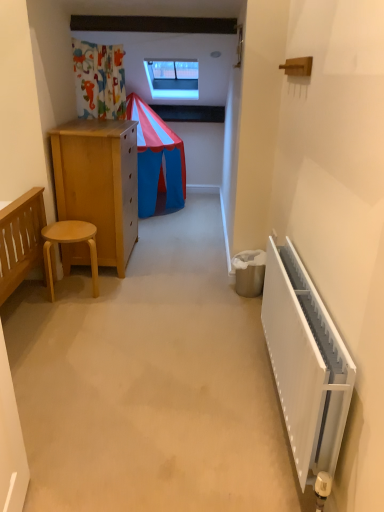
Question: Can you see light wood stool at left touching white plastic radiator at right?

Choices:
 (A) no
 (B) yes

Answer: (A)

Question: Is light wood stool at left positioned with its back to white plastic radiator at right?

Choices:
 (A) no
 (B) yes

Answer: (A)

Question: Does light wood stool at left come behind white plastic radiator at right?

Choices:
 (A) no
 (B) yes

Answer: (B)

Question: Does light wood stool at left have a greater width compared to white plastic radiator at right?

Choices:
 (A) yes
 (B) no

Answer: (A)

Question: Is light wood stool at left surrounding white plastic radiator at right?

Choices:
 (A) no
 (B) yes

Answer: (A)

Question: Considering the relative sizes of light wood stool at left and white plastic radiator at right in the image provided, is light wood stool at left thinner than white plastic radiator at right?

Choices:
 (A) yes
 (B) no

Answer: (B)

Question: Is transparent glass window at upper center not within white plastic radiator at right?

Choices:
 (A) yes
 (B) no

Answer: (A)

Question: Is transparent glass window at upper center smaller than white plastic radiator at right?

Choices:
 (A) yes
 (B) no

Answer: (B)

Question: Is transparent glass window at upper center taller than white plastic radiator at right?

Choices:
 (A) no
 (B) yes

Answer: (B)

Question: Can you confirm if transparent glass window at upper center is wider than white plastic radiator at right?

Choices:
 (A) no
 (B) yes

Answer: (B)

Question: Is transparent glass window at upper center touching white plastic radiator at right?

Choices:
 (A) yes
 (B) no

Answer: (B)

Question: From a real-world perspective, is transparent glass window at upper center positioned under white plastic radiator at right based on gravity?

Choices:
 (A) yes
 (B) no

Answer: (B)

Question: From a real-world perspective, is transparent glass window at upper center beneath light wood stool at left?

Choices:
 (A) no
 (B) yes

Answer: (A)